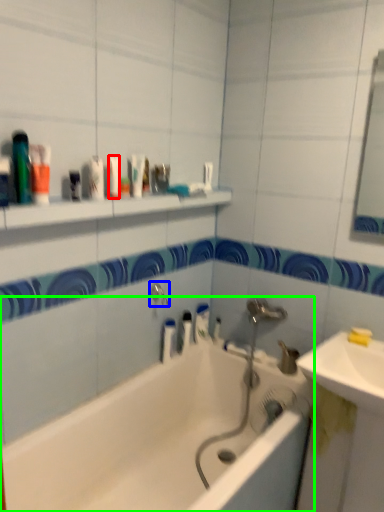
Question: Based on their relative distances, which object is farther from mouthwash (highlighted by a red box)? Choose from tap (highlighted by a blue box) and bathtub (highlighted by a green box).

Choices:
 (A) tap
 (B) bathtub

Answer: (B)